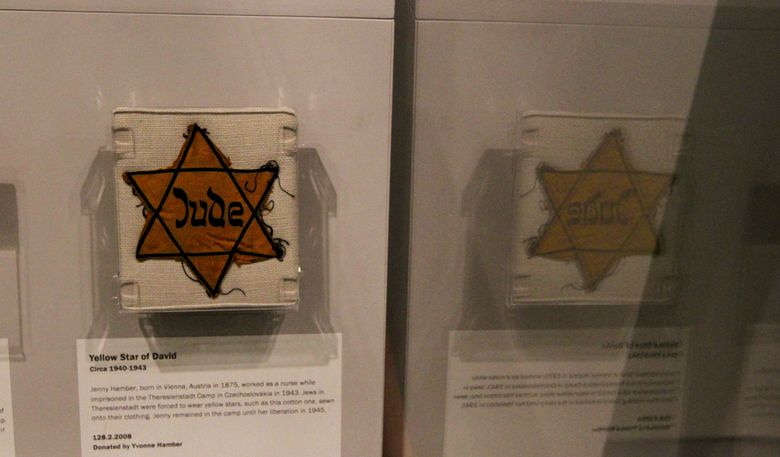
This screenshot has height=457, width=780. Identify the location of wall. [206, 93].